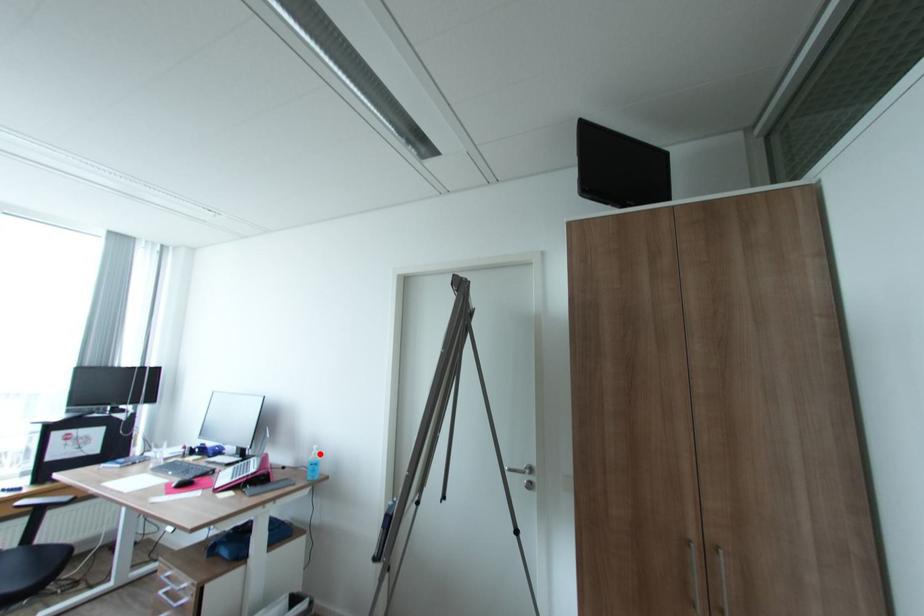
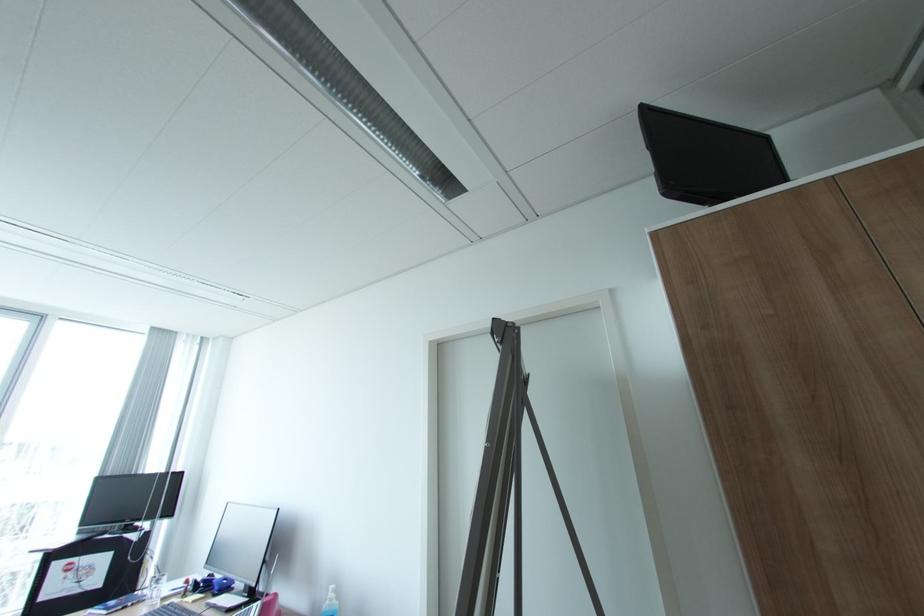
Locate, in the second image, the point that corresponds to the highlighted location in the first image.

(336, 599)